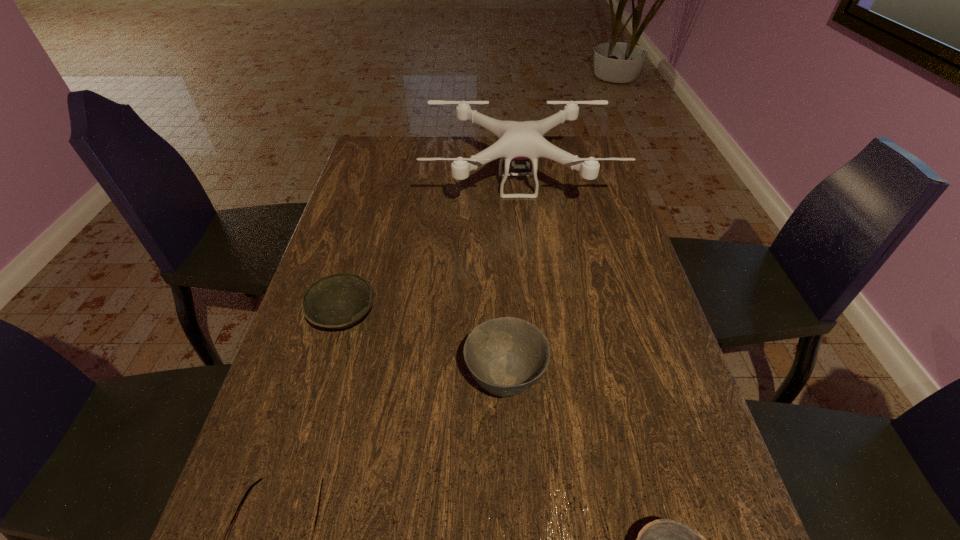
Find the location of a particular element. drone is located at coordinates tap(517, 140).

Where is `the tallest object`? the tallest object is located at coordinates (517, 140).

The width and height of the screenshot is (960, 540). In order to click on the third farthest object in this screenshot , I will do coord(506,356).

At what (x,y) coordinates should I click in order to perform the action: click on the tallest bowl. Please return your answer as a coordinate pair (x, y). Looking at the image, I should click on (506, 356).

Find the location of a particular element. The image size is (960, 540). the fourth nearest object is located at coordinates (336, 301).

This screenshot has width=960, height=540. Find the location of `the leftmost bowl`. the leftmost bowl is located at coordinates (336, 301).

Locate an element on the screen. The image size is (960, 540). free spot located 0.220m on the top of the farthest object is located at coordinates (527, 277).

The width and height of the screenshot is (960, 540). Identify the location of blank space located 0.140m on the back of the second bowl from left to right. (501, 299).

The height and width of the screenshot is (540, 960). Identify the location of vacant space positioned on the right of the second farthest object. (521, 317).

At what (x,y) coordinates should I click in order to perform the action: click on object that is positioned at the far edge. Please return your answer as a coordinate pair (x, y). The width and height of the screenshot is (960, 540). Looking at the image, I should click on 517,140.